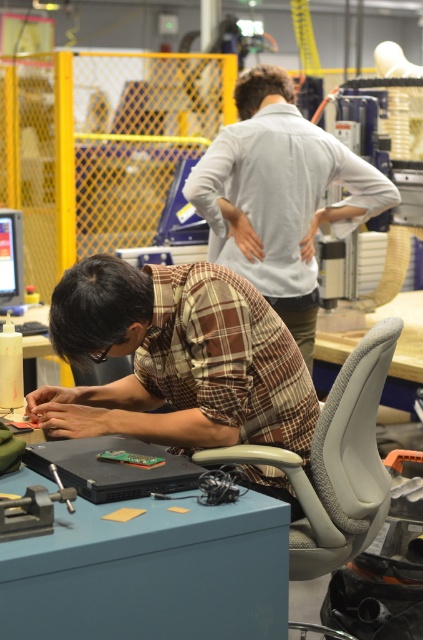
Can you confirm if white smooth shirt at upper center is bigger than gray fabric swivel chair at right?

Indeed, white smooth shirt at upper center has a larger size compared to gray fabric swivel chair at right.

In the scene shown: Is white smooth shirt at upper center wider than gray fabric swivel chair at right?

Yes, white smooth shirt at upper center is wider than gray fabric swivel chair at right.

Between point (205, 170) and point (335, 403), which one is positioned behind?

Point (205, 170)

Locate an element on the screen. This screenshot has height=640, width=423. white smooth shirt at upper center is located at coordinates (279, 196).

Is brown plaid shirt at lower left taller than gray fabric swivel chair at right?

Indeed, brown plaid shirt at lower left has a greater height compared to gray fabric swivel chair at right.

Looking at this image, who is shorter, brown plaid shirt at lower left or gray fabric swivel chair at right?

gray fabric swivel chair at right

Locate an element on the screen. Image resolution: width=423 pixels, height=640 pixels. brown plaid shirt at lower left is located at coordinates (175, 358).

Does brown plaid shirt at lower left appear under white smooth shirt at upper center?

Yes.

Which is above, brown plaid shirt at lower left or white smooth shirt at upper center?

Positioned higher is white smooth shirt at upper center.

The height and width of the screenshot is (640, 423). Describe the element at coordinates (175, 358) in the screenshot. I see `brown plaid shirt at lower left` at that location.

Identify the location of brown plaid shirt at lower left. The width and height of the screenshot is (423, 640). (175, 358).